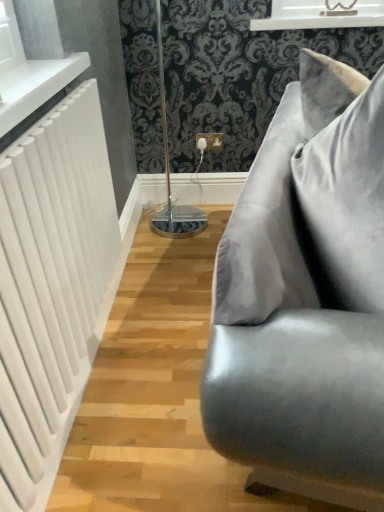
Question: Are white glossy radiator at upper left and white glossy window frame at upper center located far from each other?

Choices:
 (A) yes
 (B) no

Answer: (A)

Question: Considering the relative sizes of white glossy radiator at upper left and white glossy window frame at upper center in the image provided, is white glossy radiator at upper left smaller than white glossy window frame at upper center?

Choices:
 (A) yes
 (B) no

Answer: (A)

Question: Is white glossy window frame at upper center inside white glossy radiator at upper left?

Choices:
 (A) no
 (B) yes

Answer: (A)

Question: Is white glossy radiator at upper left positioned behind white glossy window frame at upper center?

Choices:
 (A) yes
 (B) no

Answer: (B)

Question: From the image's perspective, is white glossy radiator at upper left above white glossy window frame at upper center?

Choices:
 (A) yes
 (B) no

Answer: (B)

Question: Considering the relative positions of white glossy radiator at upper left and white glossy window frame at upper center in the image provided, is white glossy radiator at upper left to the left of white glossy window frame at upper center from the viewer's perspective?

Choices:
 (A) no
 (B) yes

Answer: (B)

Question: Is satin gray pillow at right outside of white matte radiator at left?

Choices:
 (A) no
 (B) yes

Answer: (B)

Question: From the image's perspective, does satin gray pillow at right appear lower than white matte radiator at left?

Choices:
 (A) no
 (B) yes

Answer: (A)

Question: From a real-world perspective, is satin gray pillow at right positioned over white matte radiator at left based on gravity?

Choices:
 (A) no
 (B) yes

Answer: (B)

Question: Is satin gray pillow at right shorter than white matte radiator at left?

Choices:
 (A) no
 (B) yes

Answer: (B)

Question: Is satin gray pillow at right at the left side of white matte radiator at left?

Choices:
 (A) yes
 (B) no

Answer: (B)

Question: Is satin gray pillow at right directly adjacent to white matte radiator at left?

Choices:
 (A) no
 (B) yes

Answer: (A)

Question: Is satin gray pillow at right wider than white glossy window frame at upper center?

Choices:
 (A) no
 (B) yes

Answer: (A)